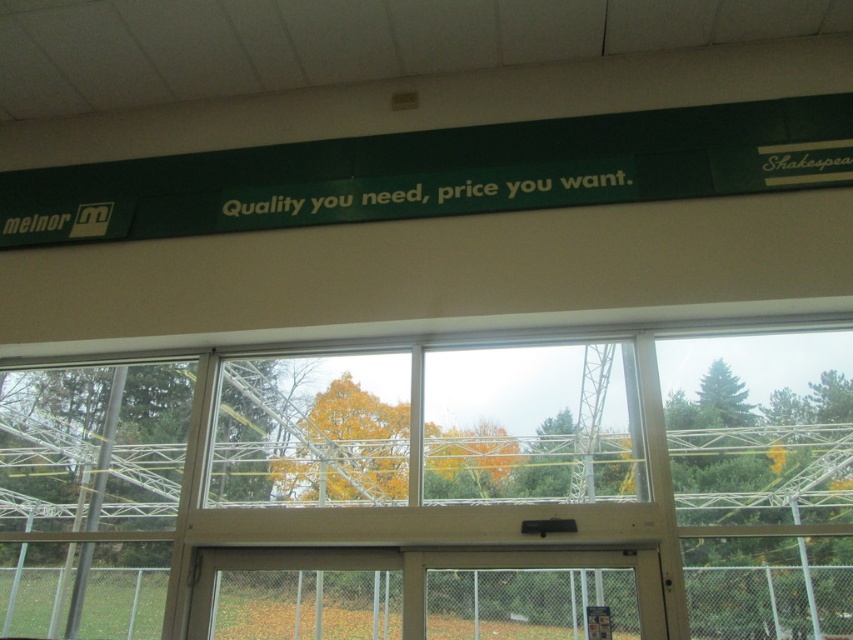
Which is behind, point (601, 337) or point (368, 212)?

The point (368, 212) is behind.

Is transparent glass window at center shorter than green matte signboard at upper center?

In fact, transparent glass window at center may be taller than green matte signboard at upper center.

The height and width of the screenshot is (640, 853). In order to click on transparent glass window at center in this screenshot , I will do `click(436, 472)`.

Where is `transparent glass window at center`? transparent glass window at center is located at coordinates (436, 472).